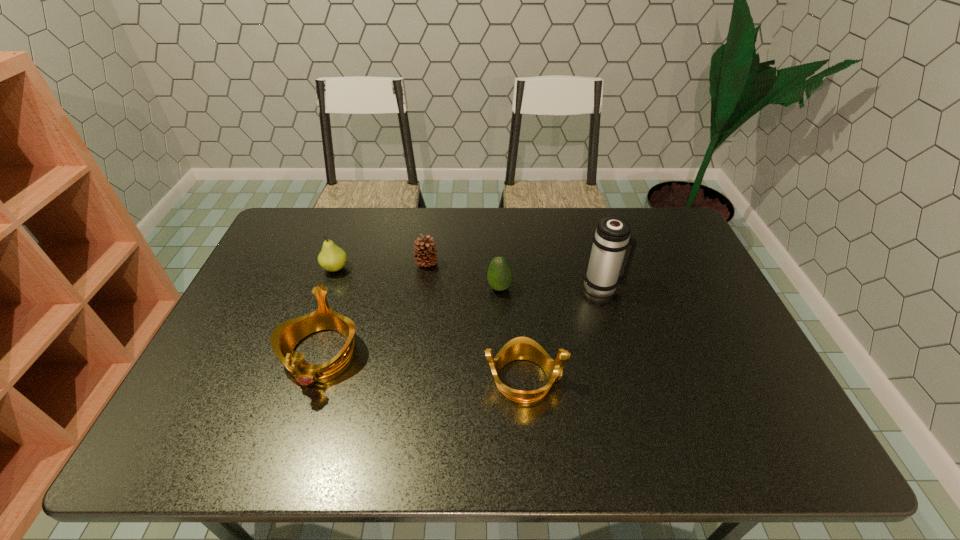
This screenshot has height=540, width=960. What are the coordinates of `vacant position located 0.140m on the side with the handle of the tallest object` in the screenshot? It's located at (669, 286).

At what (x,y) coordinates should I click in order to perform the action: click on vacant space located on the left of the avocado. Please return your answer as a coordinate pair (x, y). Looking at the image, I should click on (x=434, y=288).

Where is `vacant space at the far edge of the desktop`? The width and height of the screenshot is (960, 540). vacant space at the far edge of the desktop is located at coordinates (339, 233).

The height and width of the screenshot is (540, 960). I want to click on vacant space at the near edge, so click(x=494, y=390).

This screenshot has height=540, width=960. In the image, there is a desktop. Identify the location of free space at the left edge. (272, 251).

At what (x,y) coordinates should I click in order to perform the action: click on free space at the right edge of the desktop. Please return your answer as a coordinate pair (x, y). Looking at the image, I should click on (701, 296).

You are a GUI agent. You are given a task and a screenshot of the screen. Output one action in this format:
    pyautogui.click(x=<x>, y=<y>)
    Task: Click on the vacant space at the far left corner
    Image resolution: width=960 pixels, height=540 pixels.
    Given the screenshot: What is the action you would take?
    pyautogui.click(x=283, y=246)

Where is `vacant space at the near left corner of the desktop`? This screenshot has width=960, height=540. vacant space at the near left corner of the desktop is located at coordinates (236, 409).

Identify the location of free space at the near right corner of the desktop. This screenshot has height=540, width=960. (781, 409).

I want to click on blank region between the pinecone and the left tiara, so click(x=373, y=308).